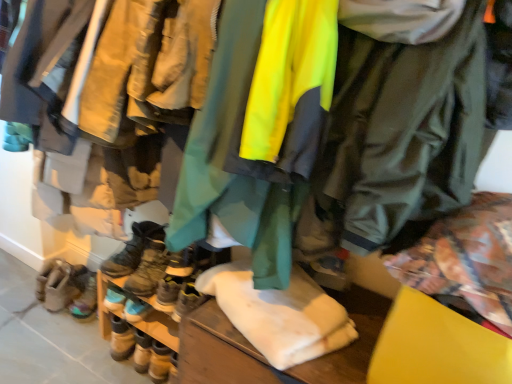
Question: Considering the positions of neon green waterproof jacket at center, placed as the 2th jacket when sorted from right to left, and leather boots at center, acting as the 5th footwear starting from the left, in the image, is neon green waterproof jacket at center, placed as the 2th jacket when sorted from right to left, taller or shorter than leather boots at center, acting as the 5th footwear starting from the left,?

Choices:
 (A) tall
 (B) short

Answer: (A)

Question: Based on their sizes in the image, would you say neon green waterproof jacket at center, the 1th jacket when ordered from left to right, is bigger or smaller than leather boots at center, acting as the 5th footwear starting from the left?

Choices:
 (A) big
 (B) small

Answer: (A)

Question: Which object is the farthest from the neon green waterproof jacket at center, the 1th jacket when ordered from left to right?

Choices:
 (A) leather boots at center, the 1th footwear in the right-to-left sequence
 (B) leather boots at lower left, which ranks as the third footwear in right-to-left order
 (C) multicolored suede boots at lower left, which ranks as the fourth footwear in right-to-left order
 (D) leather boots at lower left, placed as the 1th footwear when sorted from left to right
 (E) green matte jacket at center, the 2th jacket viewed from the left

Answer: (C)

Question: Which is nearer to the multicolored suede boots at lower left, which ranks as the fourth footwear in right-to-left order?

Choices:
 (A) leather boots at lower left, which ranks as the third footwear in right-to-left order
 (B) neon green waterproof jacket at center, the 1th jacket when ordered from left to right
 (C) leather boots at lower left, acting as the 2th footwear starting from the right
 (D) green matte jacket at center, the 1th jacket in the right-to-left sequence
 (E) leather boots at lower left, the 5th footwear when ordered from right to left

Answer: (E)